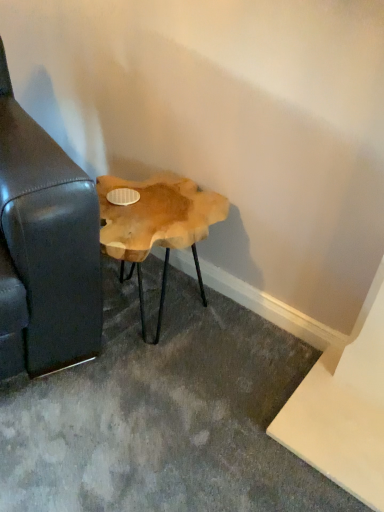
The width and height of the screenshot is (384, 512). Identify the location of vacant area on top of natural wood side table at lower left (from a real-world perspective). (148, 203).